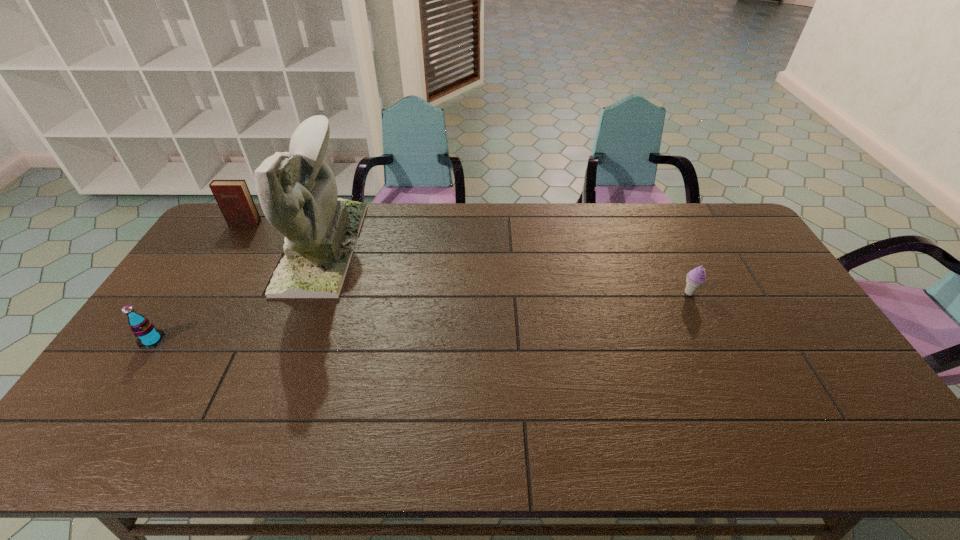
Choose which object is the nearest neighbor to the nearest object. Please provide its 2D coordinates. Your answer should be formatted as a tuple, i.e. [(x, y)], where the tuple contains the x and y coordinates of a point satisfying the conditions above.

[(297, 190)]

Locate an element on the screen. This screenshot has width=960, height=540. object that ranks as the second closest to the third shortest object is located at coordinates (147, 335).

Where is `vacant area in the image that satisfies the following two spatial constraints: 1. on the back side of the icecream; 2. on the left side of the soda`? This screenshot has width=960, height=540. vacant area in the image that satisfies the following two spatial constraints: 1. on the back side of the icecream; 2. on the left side of the soda is located at coordinates (184, 293).

Find the location of a particular element. This screenshot has height=540, width=960. free location that satisfies the following two spatial constraints: 1. on the back side of the rightmost object; 2. on the left side of the third tallest object is located at coordinates (184, 293).

Find the location of a particular element. Image resolution: width=960 pixels, height=540 pixels. blank area in the image that satisfies the following two spatial constraints: 1. on the front cover of the icecream; 2. on the right side of the diary is located at coordinates (201, 293).